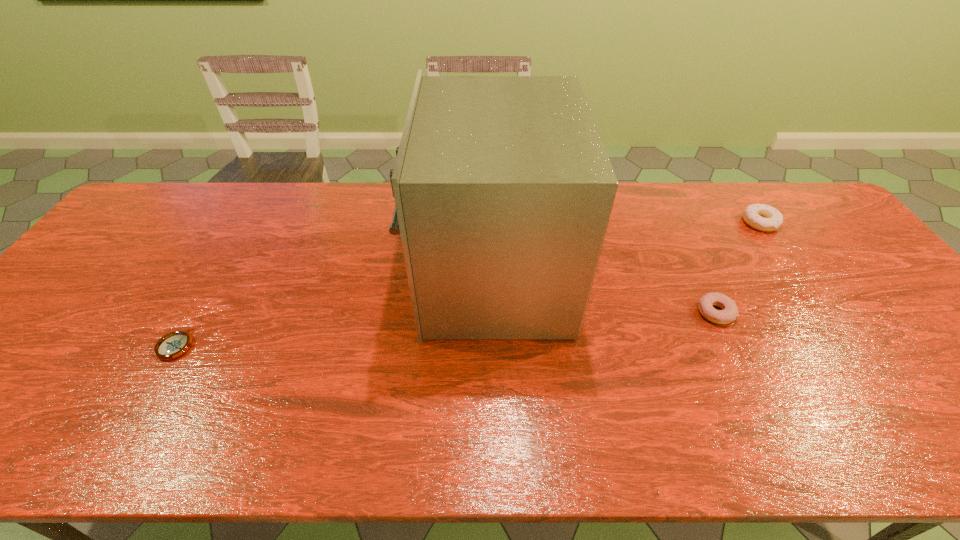
Where is `free space between the second shortest object and the third object from right to left`? free space between the second shortest object and the third object from right to left is located at coordinates (603, 293).

Where is `free spot between the second object from left to right and the nearer doughnut`? free spot between the second object from left to right and the nearer doughnut is located at coordinates (603, 293).

This screenshot has height=540, width=960. Identify the location of empty location between the toaster oven and the third object from left to right. (603, 293).

Find the location of a particular element. The height and width of the screenshot is (540, 960). free space between the shorter doughnut and the third object from right to left is located at coordinates (603, 293).

Where is `vacant area that lies between the leftmost object and the toaster oven`? The image size is (960, 540). vacant area that lies between the leftmost object and the toaster oven is located at coordinates (333, 310).

Find the location of `the closest object relative to the leftmost object`. the closest object relative to the leftmost object is located at coordinates (503, 188).

Select which object appears as the third closest to the shortest object. Please provide its 2D coordinates. Your answer should be formatted as a tuple, i.e. [(x, y)], where the tuple contains the x and y coordinates of a point satisfying the conditions above.

[(761, 217)]

What are the coordinates of `free point that satisfies the following two spatial constraints: 1. on the front side of the rightmost object; 2. on the front panel of the third object from right to left` in the screenshot? It's located at (796, 275).

Where is `vacant space that satisfies the following two spatial constraints: 1. on the front panel of the toaster oven; 2. on the front side of the leftmost object`? vacant space that satisfies the following two spatial constraints: 1. on the front panel of the toaster oven; 2. on the front side of the leftmost object is located at coordinates (492, 345).

I want to click on vacant region that satisfies the following two spatial constraints: 1. on the back side of the second object from right to left; 2. on the front panel of the toaster oven, so click(x=698, y=275).